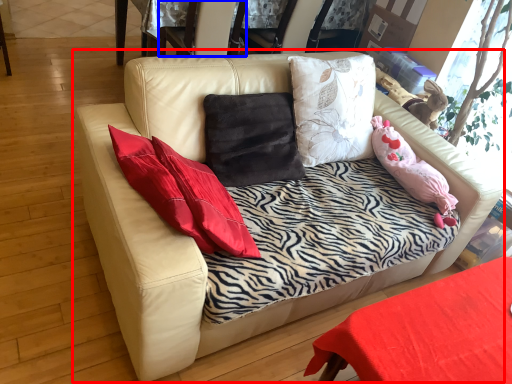
Question: Which object is further to the camera taking this photo, studio couch (highlighted by a red box) or armchair (highlighted by a blue box)?

Choices:
 (A) studio couch
 (B) armchair

Answer: (B)